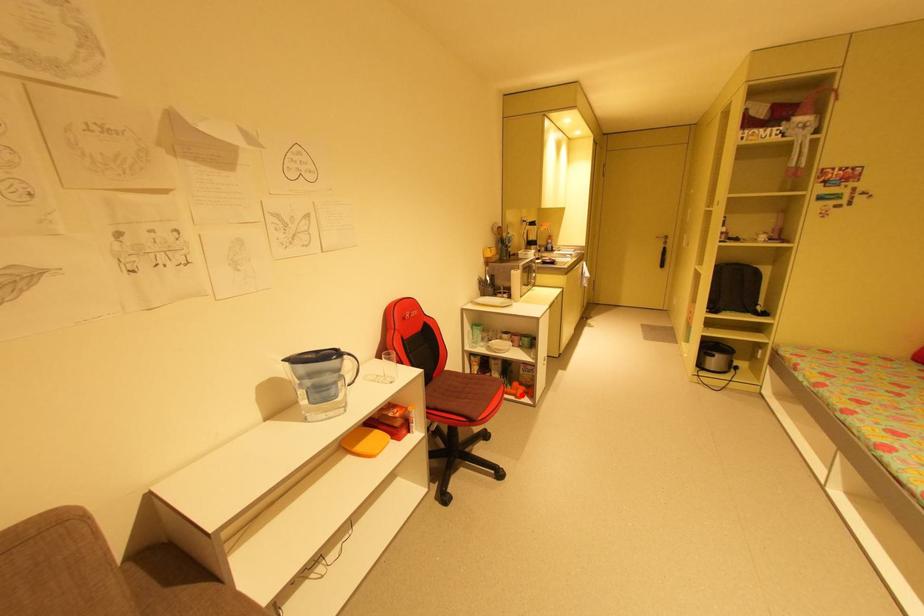
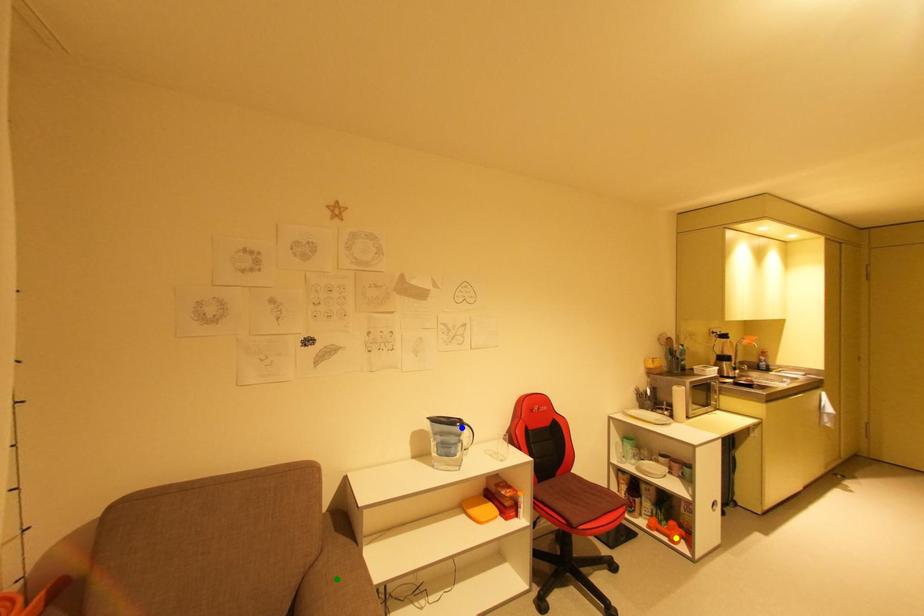
Question: I am providing you with two images of the same scene from different viewpoints. A red point is marked on the first image. You are given multiple points on the second image. Which mark in image 2 goes with the point in image 1?

Choices:
 (A) blue point
 (B) yellow point
 (C) green point

Answer: (B)